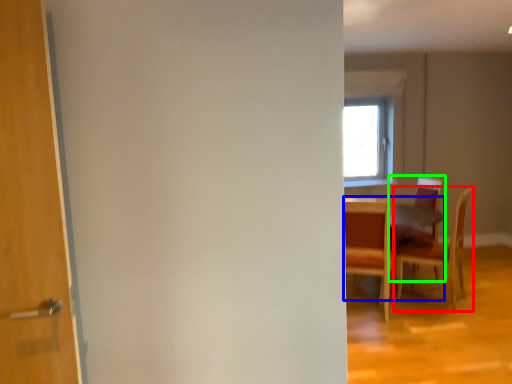
Question: Considering the real-world distances, which object is farthest from chair (highlighted by a red box)? table (highlighted by a blue box) or chair (highlighted by a green box)?

Choices:
 (A) table
 (B) chair

Answer: (A)